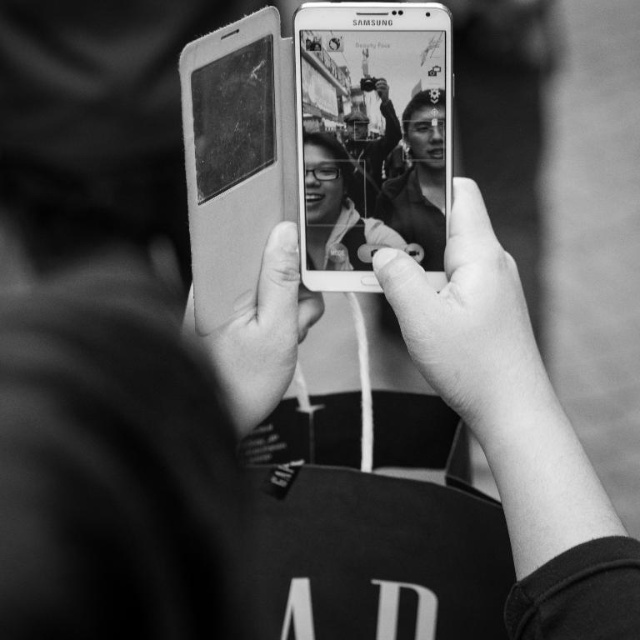
Can you confirm if leather-like white smartphone at upper center is taller than smooth skin face at center?

Correct, leather-like white smartphone at upper center is much taller as smooth skin face at center.

Which is in front, point (211, 140) or point (392, 212)?

Point (211, 140)

The image size is (640, 640). In order to click on leather-like white smartphone at upper center in this screenshot , I will do `click(236, 157)`.

Which is more to the right, smooth skin at center or smooth skin hand at center?

smooth skin at center is more to the right.

Describe the element at coordinates (472, 326) in the screenshot. I see `smooth skin at center` at that location.

Is point (435, 378) closer to camera compared to point (221, 381)?

That is False.

Locate an element on the screen. smooth skin at center is located at coordinates (472, 326).

Which is more to the left, smooth skin hand at center or smooth skin face at center?

Positioned to the left is smooth skin hand at center.

Which is behind, point (248, 410) or point (412, 136)?

Point (412, 136)

Is point (280, 317) closer to camera compared to point (404, 234)?

Yes, point (280, 317) is closer to viewer.

Find the location of a particular element. The image size is (640, 640). smooth skin hand at center is located at coordinates (260, 333).